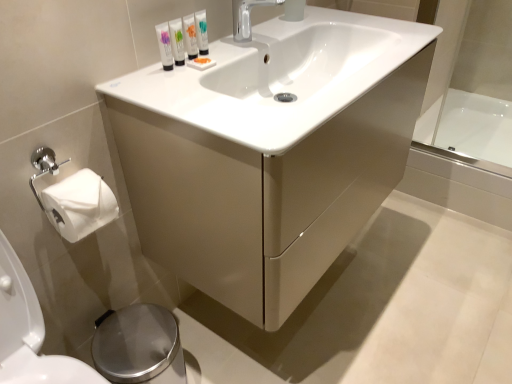
Question: Considering their positions, is matte white tube at upper center, marked as the 3th mouthwash in a left-to-right arrangement, located in front of or behind white glossy tube at upper center, which is the first mouthwash in right-to-left order?

Choices:
 (A) front
 (B) behind

Answer: (A)

Question: Is matte white tube at upper center, marked as the 3th mouthwash in a left-to-right arrangement, bigger or smaller than white glossy tube at upper center, which is the first mouthwash in right-to-left order?

Choices:
 (A) small
 (B) big

Answer: (B)

Question: Which object is the farthest from the matte white cabinet at center?

Choices:
 (A) chrome metallic faucet at center
 (B) white glossy sink at center
 (C) white glossy bathtub at right
 (D) white glossy tube at upper center, placed as the fourth mouthwash when sorted from right to left
 (E) white glossy tube at upper center, which is the first mouthwash in right-to-left order

Answer: (C)

Question: Which of these objects is positioned farthest from the white glossy bathtub at right?

Choices:
 (A) white glossy tube at upper center, which is the first mouthwash in right-to-left order
 (B) matte white tube at upper center, the second mouthwash when ordered from right to left
 (C) polished stainless steel bidet at lower left
 (D) white glossy sink at center
 (E) chrome metallic faucet at center

Answer: (C)